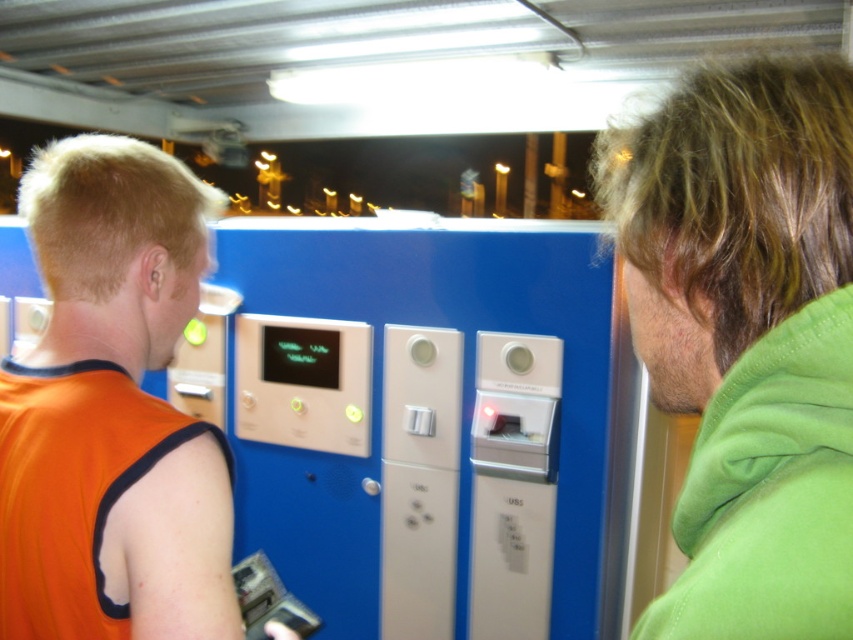
Question: Which of the following is the closest to the observer?

Choices:
 (A) green fleece jacket at right
 (B) orange fabric sleeveless shirt at left

Answer: (A)

Question: Does green fleece jacket at right have a smaller size compared to orange fabric sleeveless shirt at left?

Choices:
 (A) no
 (B) yes

Answer: (B)

Question: Among these points, which one is farthest from the camera?

Choices:
 (A) tap(102, 301)
 (B) tap(813, 365)

Answer: (A)

Question: Is green fleece jacket at right thinner than orange fabric sleeveless shirt at left?

Choices:
 (A) yes
 (B) no

Answer: (A)

Question: Is green fleece jacket at right positioned before orange fabric sleeveless shirt at left?

Choices:
 (A) yes
 (B) no

Answer: (A)